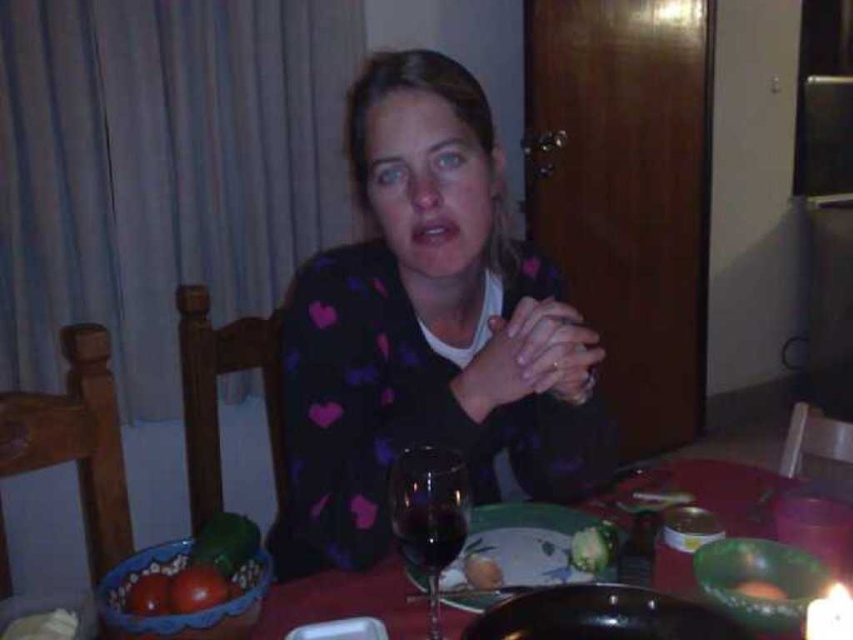
Question: Which point is farther to the camera?

Choices:
 (A) glassy dark green plate at center
 (B) transparent wax candle at lower right
 (C) transparent glass wine glass at center

Answer: (A)

Question: Which object is positioned closest to the transparent wax candle at lower right?

Choices:
 (A) smooth orange carrot at center
 (B) green glass bowl at lower right
 (C) transparent glass at center

Answer: (B)

Question: Is glassy dark green plate at center positioned behind green glass bowl at lower right?

Choices:
 (A) no
 (B) yes

Answer: (B)

Question: Does transparent wax candle at lower right lie in front of smooth orange carrot at center?

Choices:
 (A) yes
 (B) no

Answer: (A)

Question: Which of the following is the farthest from the observer?

Choices:
 (A) glassy dark green plate at center
 (B) matte glass platter at center
 (C) transparent glass wine glass at center

Answer: (A)

Question: From the image, what is the correct spatial relationship of glassy dark green plate at center in relation to transparent glass at center?

Choices:
 (A) below
 (B) above

Answer: (A)